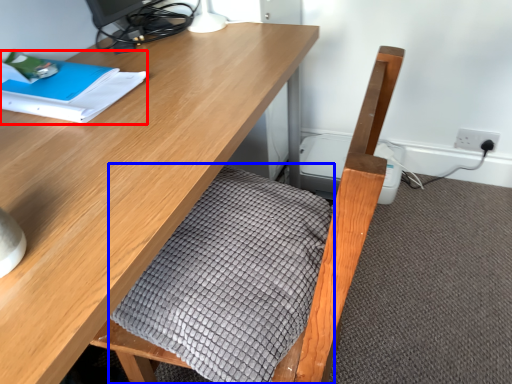
Question: Which of the following is the farthest to the observer, notebook (highlighted by a red box) or blanket (highlighted by a blue box)?

Choices:
 (A) notebook
 (B) blanket

Answer: (A)